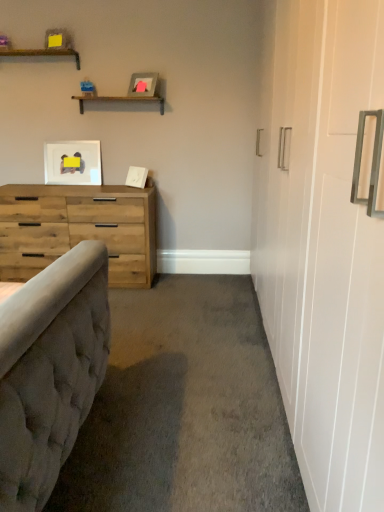
At what (x,y) coordinates should I click in order to perform the action: click on free space in front of matte white picture frame at upper left, acting as the second picture frame starting from the right. Please return your answer as a coordinate pair (x, y). Looking at the image, I should click on (71, 185).